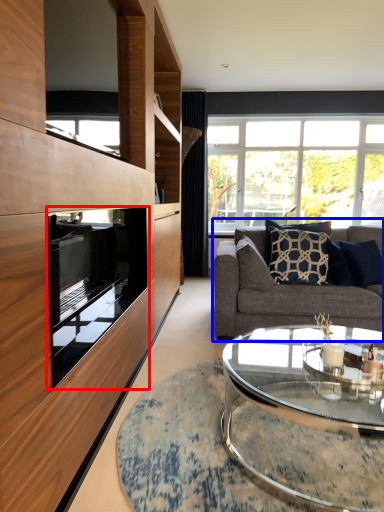
Question: Among these objects, which one is farthest to the camera, oven (highlighted by a red box) or studio couch (highlighted by a blue box)?

Choices:
 (A) oven
 (B) studio couch

Answer: (B)